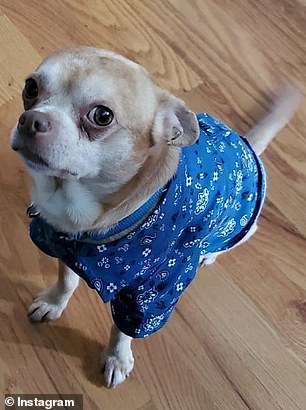
Where is `wooden floor`? Image resolution: width=306 pixels, height=410 pixels. wooden floor is located at coordinates (265, 322).